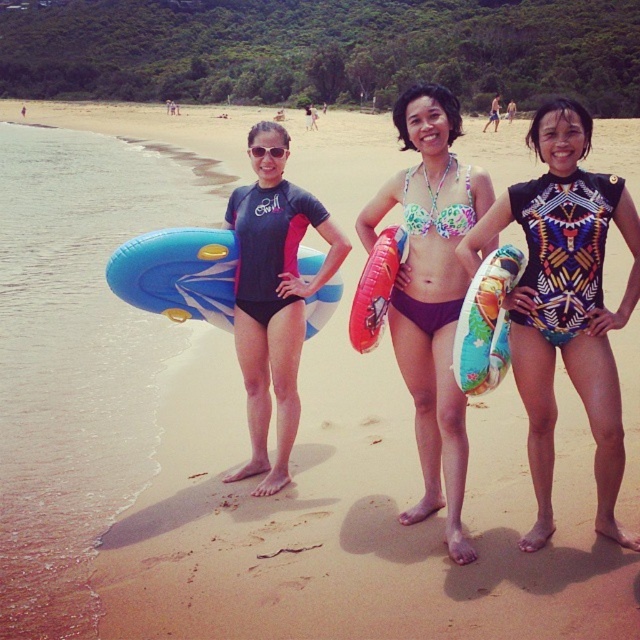
You are a photographer trying to capture a closeup shot of the printed fabric swimsuit at center and the multicolored inflatable ring at center. Based on the scene described, can you determine if the distance between them is suitable for a single focused shot without needing to adjust your camera focus?

The printed fabric swimsuit at center is 3.34 feet away from the multicolored inflatable ring at center. Since the distance between them is relatively small, the camera can likely capture both in focus without needing adjustment, assuming a standard aperture setting.

You are a photographer at the beach scene. You notice the floral bikini at center and the red inflatable ring at center. Which object is covering the other?

The floral bikini at center is positioned over red inflatable ring at center, so it is covering the red inflatable ring at center.

You are standing at the point labeled as point (432, 292) in the image. Looking around, you see three people on the beach. Which person are you closest to?

You are closest to the floral bikini at center because the point (432, 292) is on the floral bikini at center.